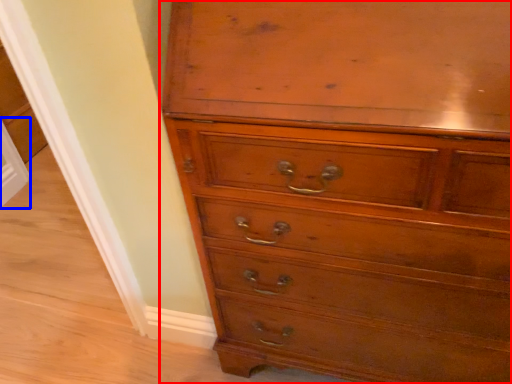
Question: Among these objects, which one is farthest to the camera, chest of drawers (highlighted by a red box) or screen door (highlighted by a blue box)?

Choices:
 (A) chest of drawers
 (B) screen door

Answer: (B)